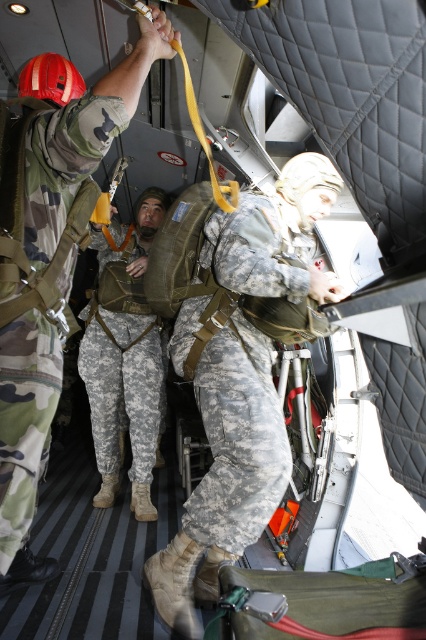
You are a military equipment inspector checking the dimensions of the soldiers clothing in the aircraft. The camouflage fabric uniform at center and the camouflage fabric pants at center are both in view. Which clothing item has a greater width?

The camouflage fabric uniform at center has a greater width than the camouflage fabric pants at center according to the description.

You are a soldier inside the aircraft and want to locate two specific points marked in the scene. The first point is at coordinates point (11, 408) and the second is at point (103, 508). Which point is nearer to your current position?

Point (11, 408) is closer to the camera than point (103, 508), so the first point is nearer to your current position.

You are inside the military aircraft preparing for a jump. You need to locate the camouflage fabric uniform at center. Based on its coordinates, is it closer to the left or right side of the aircraft?

The camouflage fabric uniform at center is located at point 0.567 on the x and y axis, which is closer to the right side of the aircraft.